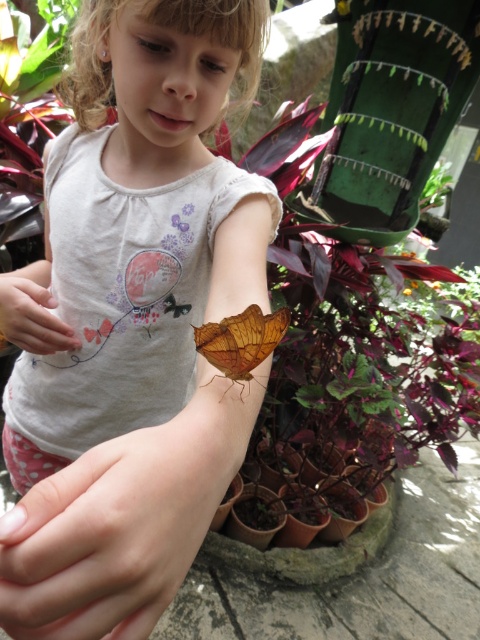
You are standing in the garden and want to reach the point marked at coordinates (x=247, y=200). If your arm is 24 inches long, can you comfortably reach that point without moving your feet?

The point at coordinates (x=247, y=200) is 22.69 inches away from you. Since your arm is 24 inches long, you can comfortably reach it without moving your feet.

Where is the matte orange butterfly at upper right located in the image?

The matte orange butterfly at upper right is located at point (135, 323) in the image.

Based on the photo, you are a photographer standing 10 feet away from the girl and the matte orange butterfly at upper right. You want to take a closeup photo of the butterfly. Do you need to move closer or farther away to get the butterfly in focus?

The matte orange butterfly at upper right is 7.78 inches away from viewer. Since you are currently 10 feet away, you need to move closer to the butterfly to get it in focus for the closeup photo.